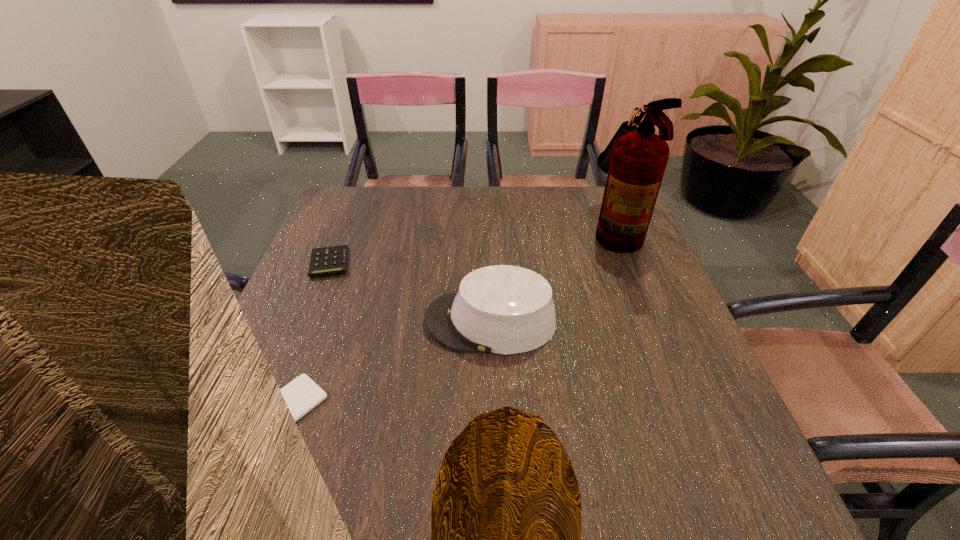
I want to click on the tallest object, so click(635, 159).

Identify the location of the rightmost object. (635, 159).

This screenshot has height=540, width=960. What are the coordinates of `hat` in the screenshot? It's located at (501, 309).

The width and height of the screenshot is (960, 540). What are the coordinates of `the third farthest object` in the screenshot? It's located at (501, 309).

Find the location of a particular element. The width and height of the screenshot is (960, 540). the second shortest object is located at coordinates (328, 260).

At what (x,y) coordinates should I click in order to perform the action: click on the farther calculator. Please return your answer as a coordinate pair (x, y). This screenshot has width=960, height=540. Looking at the image, I should click on (328, 260).

I want to click on the shorter calculator, so click(302, 394).

Where is `the shortest object`? This screenshot has height=540, width=960. the shortest object is located at coordinates (302, 394).

Identify the location of free region located at the nozzle of the fire extinguisher. (526, 230).

The image size is (960, 540). I want to click on vacant area situated 0.380m at the nozzle of the fire extinguisher, so click(x=461, y=230).